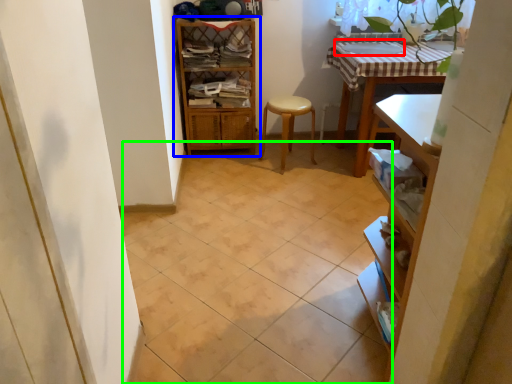
Question: Which object is the closest to the sink (highlighted by a red box)? Choose among these: shelf (highlighted by a blue box) or ceramic tile (highlighted by a green box).

Choices:
 (A) shelf
 (B) ceramic tile

Answer: (A)